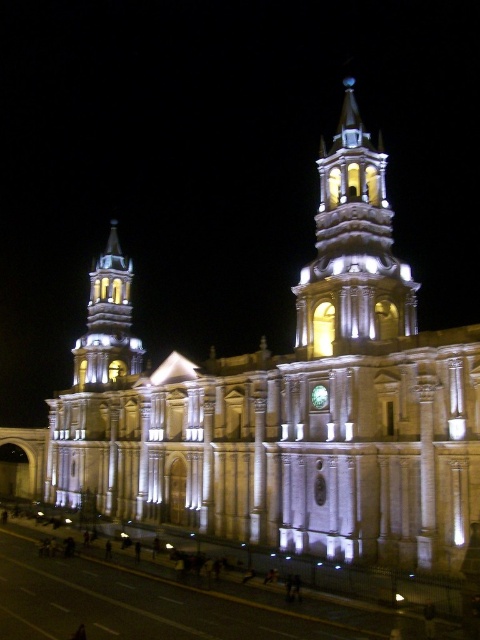
Question: Which point is farther to the camera?

Choices:
 (A) white stone tower at upper center
 (B) white stone tower at left

Answer: (B)

Question: Which point is farther from the camera taking this photo?

Choices:
 (A) (367, 138)
 (B) (93, 278)

Answer: (B)

Question: Can you confirm if white stone tower at upper center is positioned below white stone tower at left?

Choices:
 (A) no
 (B) yes

Answer: (A)

Question: Does white stone tower at upper center appear over white stone tower at left?

Choices:
 (A) no
 (B) yes

Answer: (B)

Question: Can you confirm if white stone tower at upper center is smaller than white stone tower at left?

Choices:
 (A) no
 (B) yes

Answer: (A)